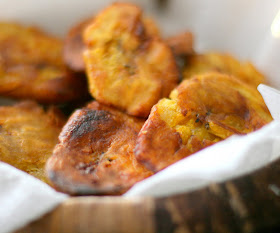
Image resolution: width=280 pixels, height=233 pixels. What are the coordinates of `top edge of brown wooden like dish` in the screenshot? It's located at (117, 199).